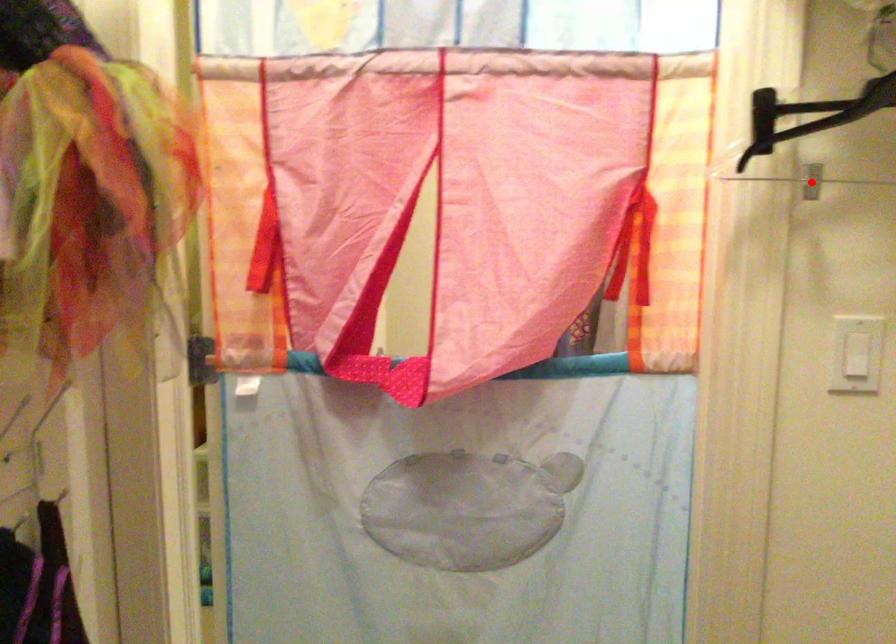
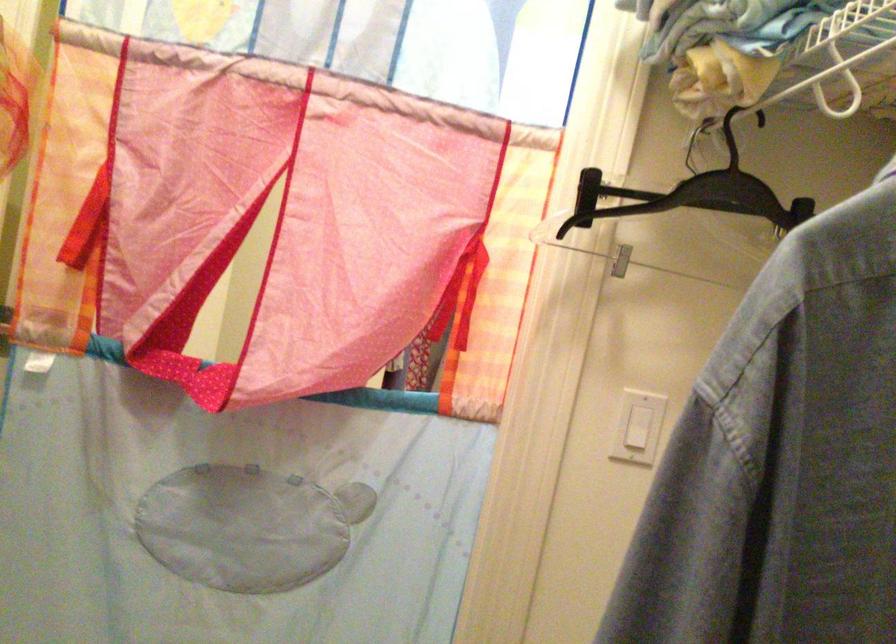
The point at the highlighted location is marked in the first image. Where is the corresponding point in the second image?

(622, 261)